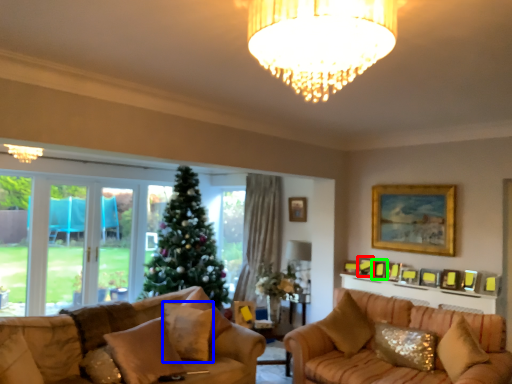
Question: Which object is positioned closest to picture frame (highlighted by a red box)? Select from pillow (highlighted by a blue box) and picture frame (highlighted by a green box).

Choices:
 (A) pillow
 (B) picture frame

Answer: (B)